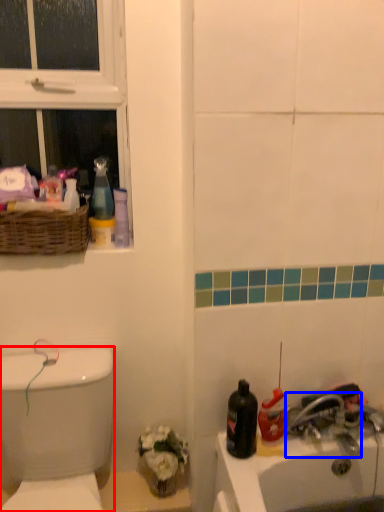
Question: Among these objects, which one is nearest to the camera, porcelain (highlighted by a red box) or tap (highlighted by a blue box)?

Choices:
 (A) porcelain
 (B) tap

Answer: (A)